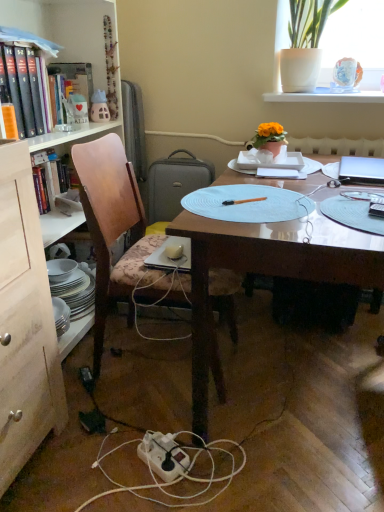
Image resolution: width=384 pixels, height=512 pixels. I want to click on vacant space that is in between white plastic power outlet at lower center and black plastic power plugs and sockets at lower left, which appears as the 1th power plugs and sockets when viewed from the back, so click(118, 413).